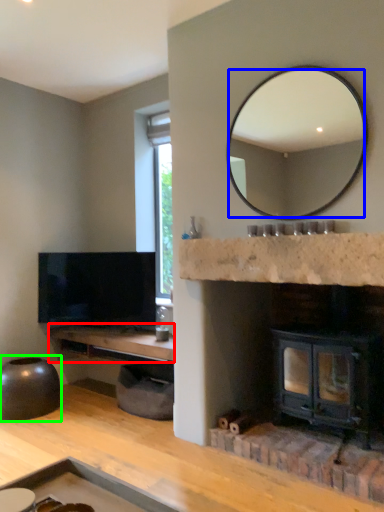
Question: Based on their relative distances, which object is farther from counter top (highlighted by a red box)? Choose from mirror (highlighted by a blue box) and round table (highlighted by a green box).

Choices:
 (A) mirror
 (B) round table

Answer: (A)